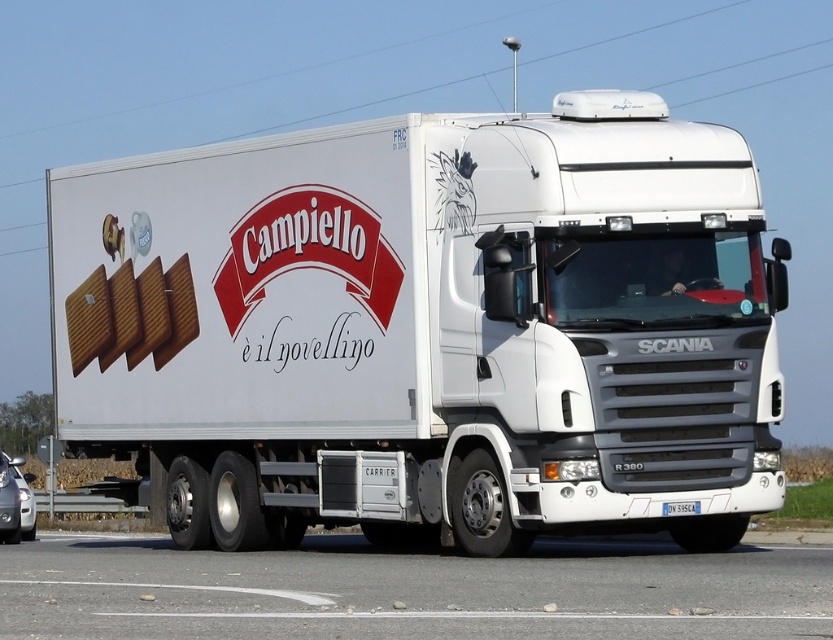
Question: Among these objects, which one is nearest to the camera?

Choices:
 (A) white plastic license plate at center
 (B) silver metallic car at lower left
 (C) white matte truck at center

Answer: (C)

Question: Does asphalt at lower center lie in front of silver metallic car at lower left?

Choices:
 (A) yes
 (B) no

Answer: (A)

Question: Among these points, which one is nearest to the camera?

Choices:
 (A) (692, 500)
 (B) (191, 472)

Answer: (A)

Question: Is white matte truck at center positioned in front of asphalt at lower center?

Choices:
 (A) yes
 (B) no

Answer: (B)

Question: Can you confirm if asphalt at lower center is bigger than white plastic license plate at center?

Choices:
 (A) yes
 (B) no

Answer: (A)

Question: Which of the following is the farthest from the observer?

Choices:
 (A) asphalt at lower center
 (B) white matte truck at center

Answer: (B)